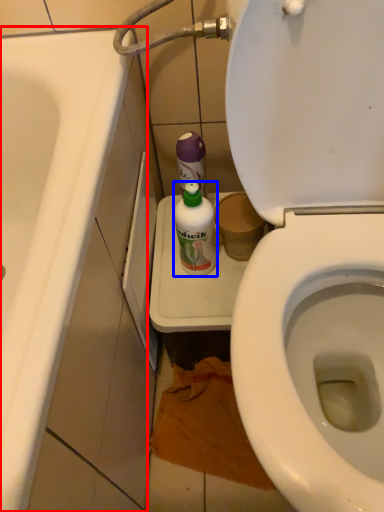
Question: Which object appears closest to the camera in this image, bath (highlighted by a red box) or cleaning product (highlighted by a blue box)?

Choices:
 (A) bath
 (B) cleaning product

Answer: (A)